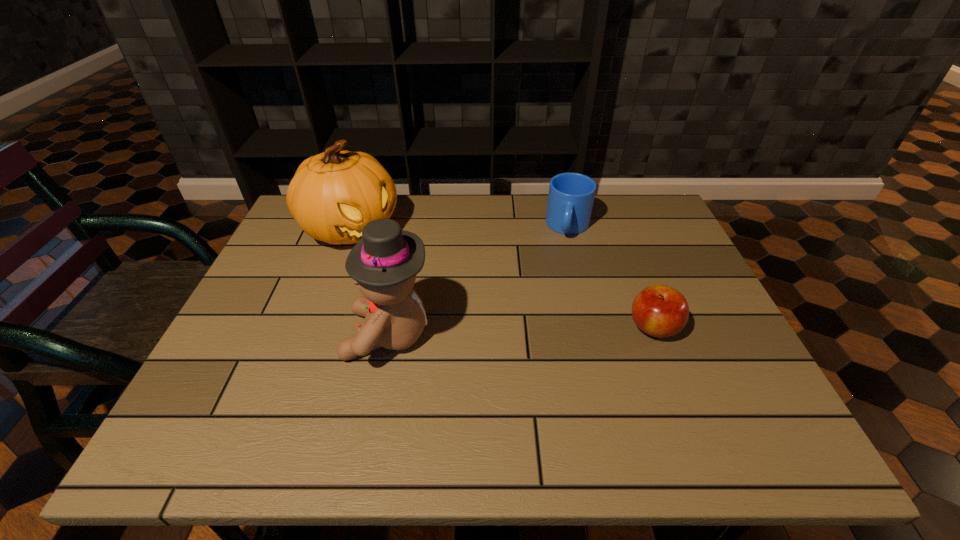
You are a GUI agent. You are given a task and a screenshot of the screen. Output one action in this format:
    pyautogui.click(x=<x>, y=<y>)
    Task: Click on the free spot on the desktop that is between the rag_doll and the rightmost object and is positioned on the side of the second shortest object with the handle
    This screenshot has width=960, height=540.
    Given the screenshot: What is the action you would take?
    pyautogui.click(x=554, y=330)

The image size is (960, 540). Find the location of `vacant space on the desktop that is between the rag_doll and the shortest object and is positioned on the front face of the pumpkin`. vacant space on the desktop that is between the rag_doll and the shortest object and is positioned on the front face of the pumpkin is located at coordinates (504, 332).